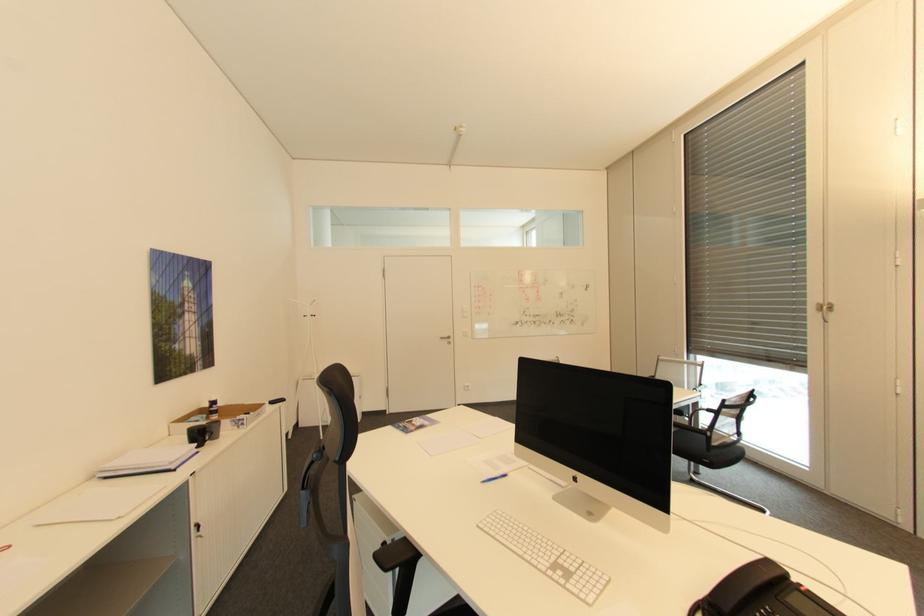
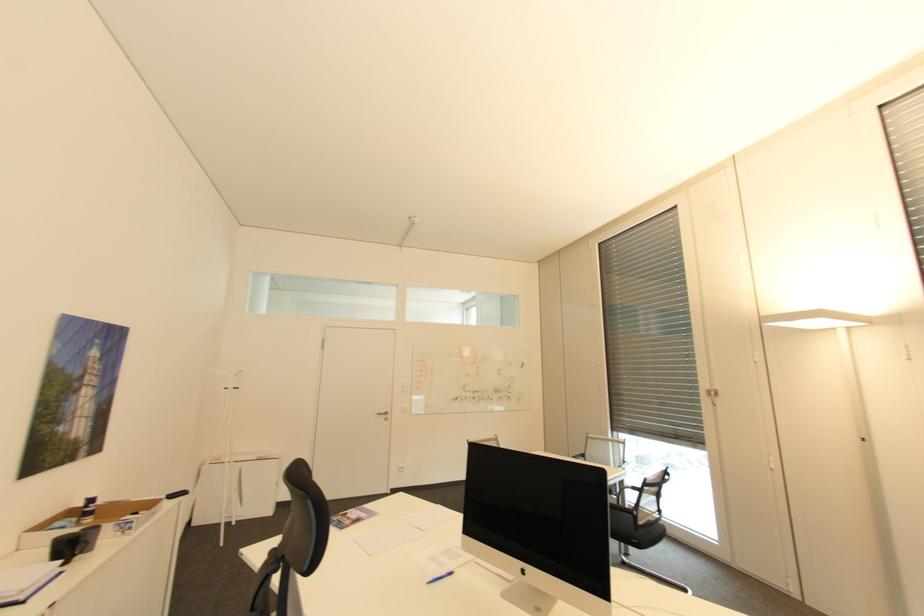
Where in the second image is the point corresponding to (x=286, y=400) from the first image?

(188, 493)